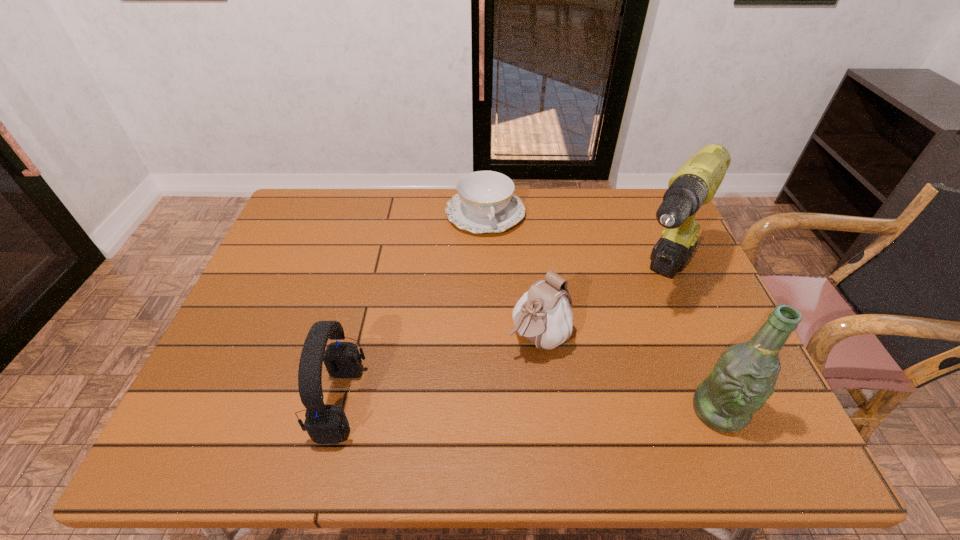
Locate which object ranks in proximity to the pouch. Please provide its 2D coordinates. Your answer should be formatted as a tuple, i.e. [(x, y)], where the tuple contains the x and y coordinates of a point satisfying the conditions above.

[(696, 182)]

Image resolution: width=960 pixels, height=540 pixels. I want to click on blank area in the image that satisfies the following two spatial constraints: 1. on the front side of the drill; 2. on the left side of the shortest object, so click(486, 279).